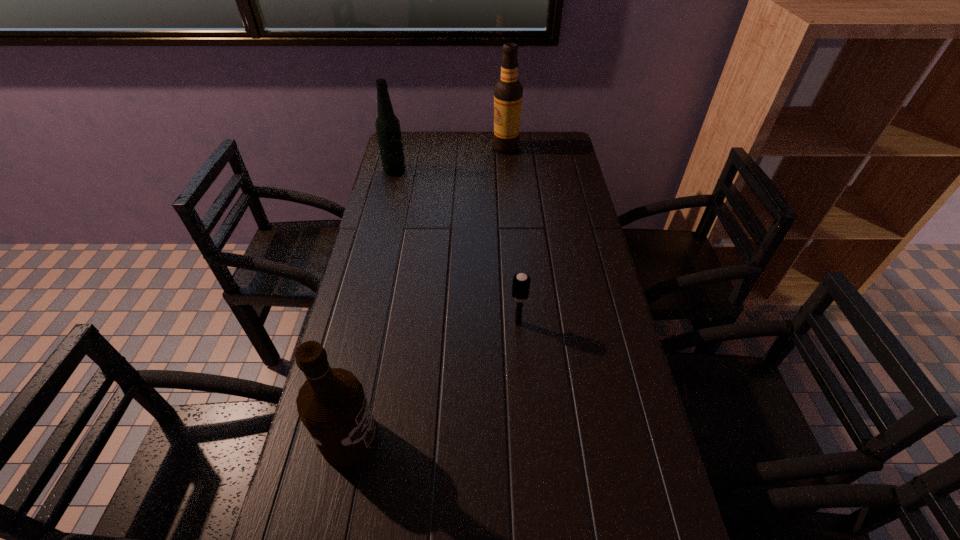
Locate an element on the screen. The width and height of the screenshot is (960, 540). empty space that is in between the nearest alcohol and the farthest object is located at coordinates (427, 293).

This screenshot has width=960, height=540. I want to click on free space that is in between the second farthest alcohol and the nearest alcohol, so click(x=372, y=304).

You are a GUI agent. You are given a task and a screenshot of the screen. Output one action in this format:
    pyautogui.click(x=<x>, y=<y>)
    Task: Click on the free space that is in between the nearest object and the rightmost alcohol
    This screenshot has height=540, width=960.
    Given the screenshot: What is the action you would take?
    pyautogui.click(x=427, y=293)

The width and height of the screenshot is (960, 540). I want to click on free spot between the farthest alcohol and the third nearest object, so click(450, 159).

At what (x,y) coordinates should I click in order to perform the action: click on vacant area between the third farthest object and the second nearest alcohol. Please return your answer as a coordinate pair (x, y). Looking at the image, I should click on (456, 247).

Locate an element on the screen. This screenshot has width=960, height=540. empty space that is in between the third nearest object and the farthest object is located at coordinates (450, 159).

Where is `empty space between the third nearest object and the rightmost alcohol`? empty space between the third nearest object and the rightmost alcohol is located at coordinates (450, 159).

At what (x,y) coordinates should I click in order to perform the action: click on the second closest object to the hairbrush. Please return your answer as a coordinate pair (x, y). This screenshot has width=960, height=540. Looking at the image, I should click on (387, 125).

Identify which object is located as the nearest to the hairbrush. Please provide its 2D coordinates. Your answer should be formatted as a tuple, i.e. [(x, y)], where the tuple contains the x and y coordinates of a point satisfying the conditions above.

[(332, 405)]

The width and height of the screenshot is (960, 540). I want to click on the second closest alcohol to the farthest object, so click(x=332, y=405).